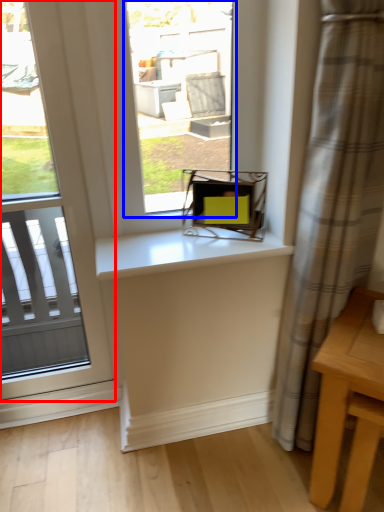
Question: Which point is closer to the camera, window (highlighted by a red box) or window (highlighted by a blue box)?

Choices:
 (A) window
 (B) window

Answer: (A)